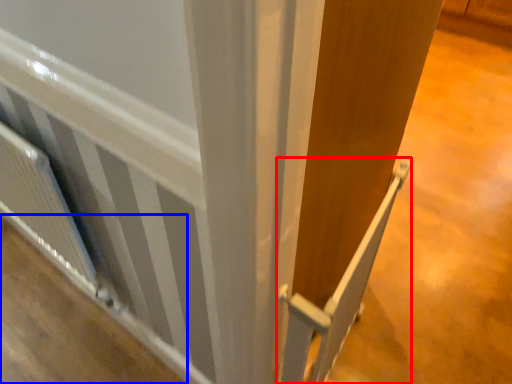
Question: Which point is closer to the camera, rail (highlighted by a red box) or plywood (highlighted by a blue box)?

Choices:
 (A) rail
 (B) plywood

Answer: (A)